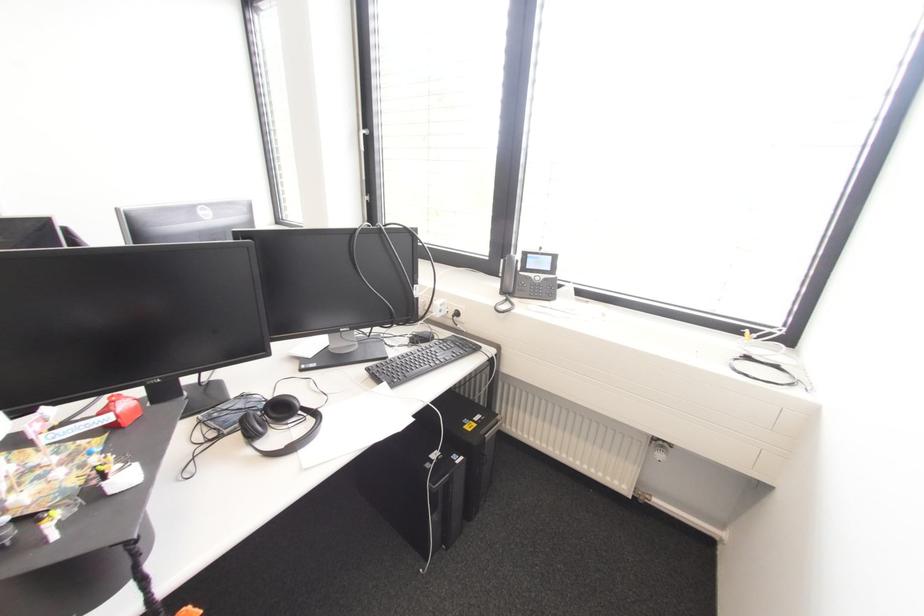
The image size is (924, 616). What do you see at coordinates (369, 113) in the screenshot? I see `a silver window handle` at bounding box center [369, 113].